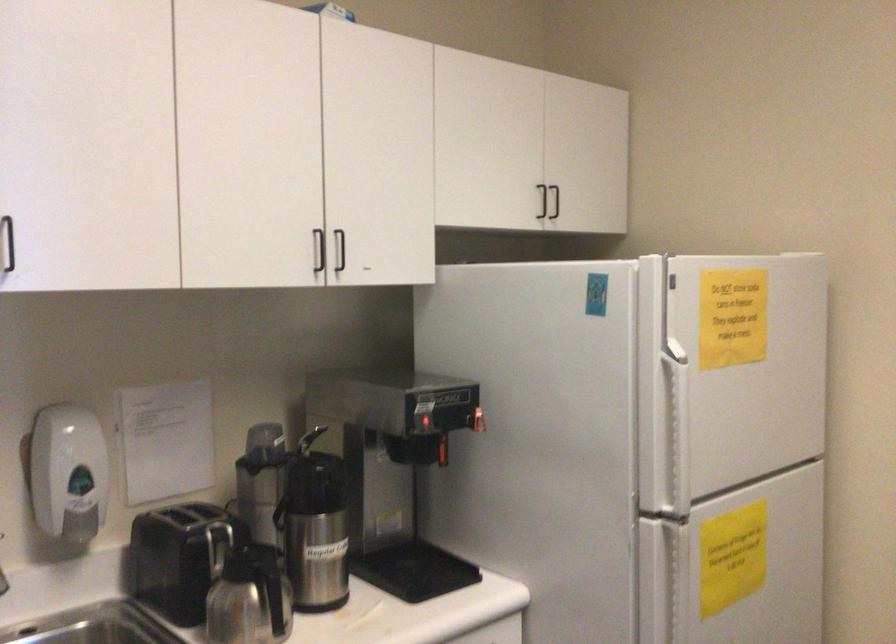
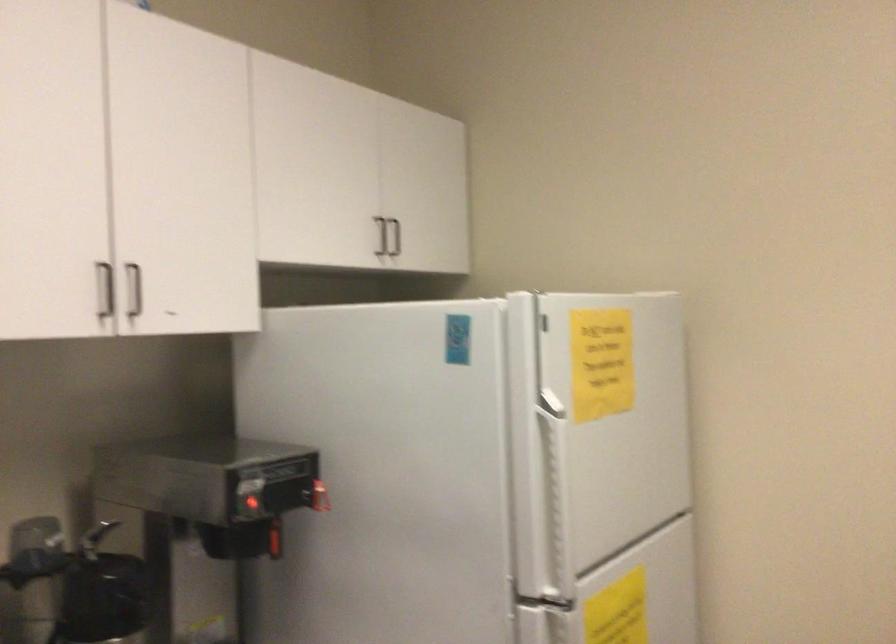
Where in the second image is the point corresponding to (670,424) from the first image?

(554, 486)